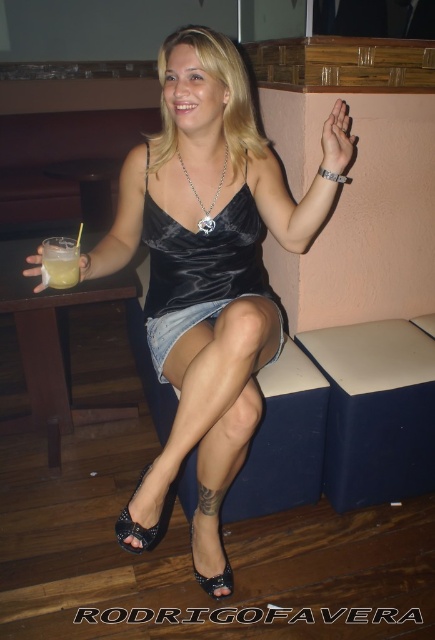
Find the location of `satin black dress at center`. satin black dress at center is located at coordinates (210, 262).

Does point (147, 230) come closer to viewer compared to point (140, 540)?

No, (147, 230) is behind (140, 540).

This screenshot has width=435, height=640. Identify the location of satin black dress at center. (210, 262).

Can you confirm if satin black dress at center is bigger than black satin sandal at lower center?

Yes, satin black dress at center is bigger than black satin sandal at lower center.

Between satin black dress at center and black satin sandal at lower center, which one is positioned lower?

black satin sandal at lower center is lower down.

Describe the element at coordinates (210, 262) in the screenshot. I see `satin black dress at center` at that location.

Find the location of `satin black dress at center`. satin black dress at center is located at coordinates [x=210, y=262].

Can you confirm if translucent glass drink at lower left is wider than black leather sandal at lower left?

Yes, translucent glass drink at lower left is wider than black leather sandal at lower left.

Find the location of a particular element. The height and width of the screenshot is (640, 435). translucent glass drink at lower left is located at coordinates (60, 262).

Find the location of a particular element. translucent glass drink at lower left is located at coordinates (60, 262).